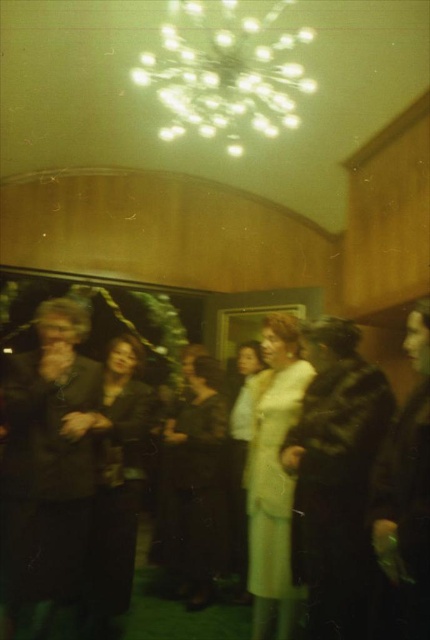
Is dark brown leather jacket at left smaller than white satin dress at center?

Yes.

Which is behind, point (28, 586) or point (233, 524)?

Point (233, 524)

This screenshot has height=640, width=430. In order to click on dark brown leather jacket at left in this screenshot , I will do `click(49, 460)`.

Can you confirm if light yellow fabric coat at center is wider than white satin dress at center?

Yes.

In the scene shown: Between light yellow fabric coat at center and white satin dress at center, which one has less height?

Standing shorter between the two is light yellow fabric coat at center.

Which is behind, point (297, 372) or point (245, 381)?

Positioned behind is point (245, 381).

The image size is (430, 640). In order to click on light yellow fabric coat at center in this screenshot , I will do `click(273, 476)`.

Does dark brown leather jacket at left have a greater height compared to leather jacket at right?

Correct, dark brown leather jacket at left is much taller as leather jacket at right.

Identify the location of dark brown leather jacket at left. This screenshot has width=430, height=640. tap(49, 460).

Find the location of a particular element. dark brown leather jacket at left is located at coordinates (49, 460).